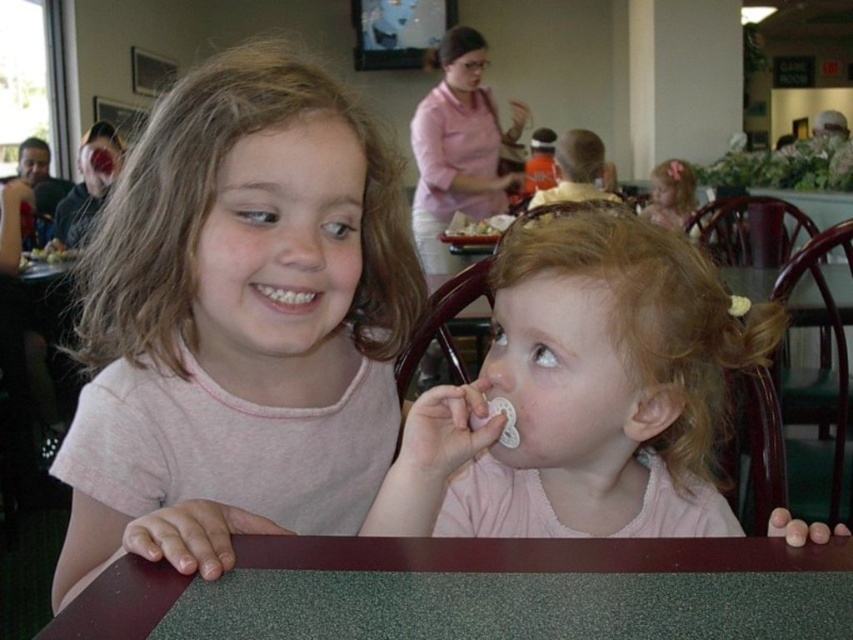
Which is behind, point (96, 428) or point (666, 244)?

The point (96, 428) is behind.

Which is below, pink cotton shirt at upper left or pink fabric pacifier at center?

Positioned lower is pink fabric pacifier at center.

This screenshot has height=640, width=853. What are the coordinates of `pink cotton shirt at upper left` in the screenshot? It's located at (238, 323).

Which is below, pink cotton shirt at upper left or green felt table at center?

green felt table at center is lower down.

Who is shorter, pink cotton shirt at upper left or green felt table at center?

Standing shorter between the two is green felt table at center.

This screenshot has width=853, height=640. What do you see at coordinates (238, 323) in the screenshot?
I see `pink cotton shirt at upper left` at bounding box center [238, 323].

Find the location of a particular element. Image resolution: width=853 pixels, height=640 pixels. pink cotton shirt at upper left is located at coordinates (238, 323).

Who is positioned more to the right, green felt table at center or blonde curly hair at upper right?

blonde curly hair at upper right

Does green felt table at center appear on the left side of blonde curly hair at upper right?

Correct, you'll find green felt table at center to the left of blonde curly hair at upper right.

You are a GUI agent. You are given a task and a screenshot of the screen. Output one action in this format:
    pyautogui.click(x=<x>, y=<y>)
    Task: Click on the green felt table at center
    
    Given the screenshot: What is the action you would take?
    pyautogui.click(x=538, y=554)